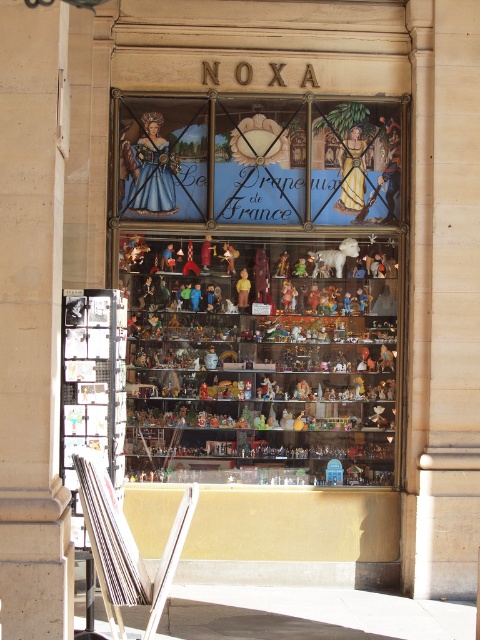
Question: Which point is closer to the camera?

Choices:
 (A) (336, 260)
 (B) (248, 294)
 (C) (367, 420)

Answer: (A)

Question: Is multicolored figurines at center thinner than white plush bear at center?

Choices:
 (A) yes
 (B) no

Answer: (B)

Question: Which point appears farthest from the camera in this image?

Choices:
 (A) (250, 285)
 (B) (288, 333)
 (C) (350, 240)

Answer: (B)

Question: Which object is closer to the camera taking this photo?

Choices:
 (A) white plush bear at center
 (B) multicolored figurines at center
 (C) matte yellow figurine at center

Answer: (B)

Question: Is white plush bear at center bigger than matte yellow figurine at center?

Choices:
 (A) no
 (B) yes

Answer: (B)

Question: Does white plush bear at center have a larger size compared to matte yellow figurine at center?

Choices:
 (A) yes
 (B) no

Answer: (A)